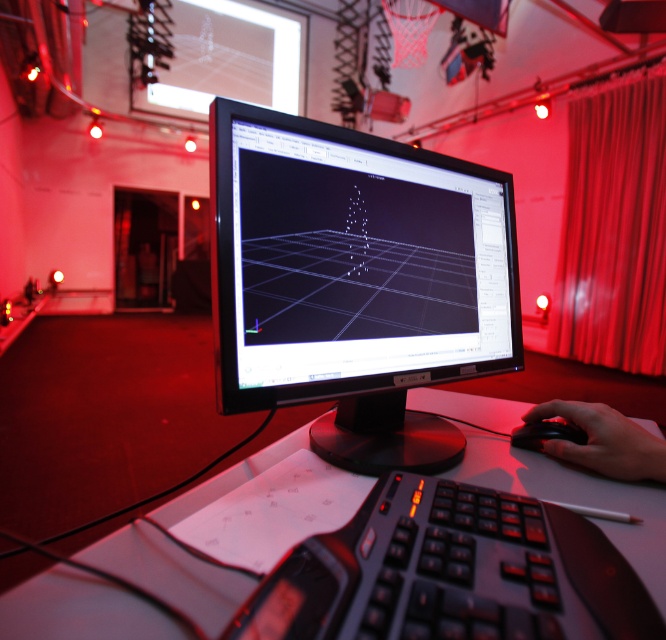
You are working on the computer monitor at the center and need to reach the black plastic mouse at center. However, there is a silky white curtain at center in the way. Can you easily access the mouse without moving the curtain?

The silky white curtain at center is positioned over the black plastic mouse at center, so you cannot easily access the mouse without moving the curtain.

Looking at this image, you are setting up a new desk and want to place the black matte keyboard at center and the black matte mouse at lower right. If the desk has a 15 cm height requirement for all items, can both items meet this requirement based on their heights?

Answer: The black matte keyboard at center is shorter than the black matte mouse at lower right. Since the mouse is taller, if the mouse meets the 15 cm height requirement, the keyboard might be too short. However, without specific measurements, we cannot confirm if both meet the requirement. Please check their exact heights.

Looking at this image, you are working on a 3D modeling project and need to adjust the position of the points on the screen. Based on the scene, which of the two points, point (513,538) or point (609,408), is closer to you as you sit in front of the monitor?

Point (513,538) is closer to the viewer than point (609,408).